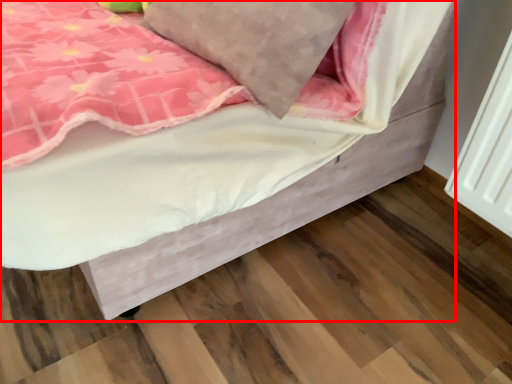
Question: From the image, what is the correct spatial relationship of bed (annotated by the red box) in relation to pillow?

Choices:
 (A) right
 (B) left

Answer: (B)